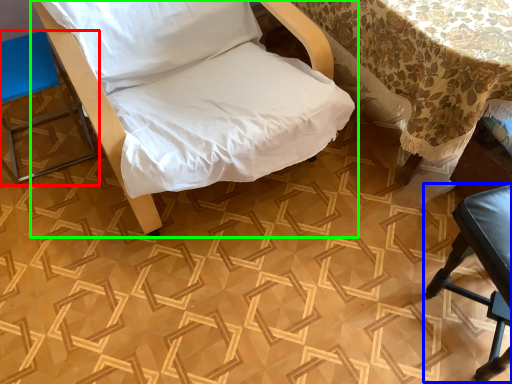
Question: Which is nearer to the furniture (highlighted by a red box)? furniture (highlighted by a blue box) or furniture (highlighted by a green box).

Choices:
 (A) furniture
 (B) furniture

Answer: (B)